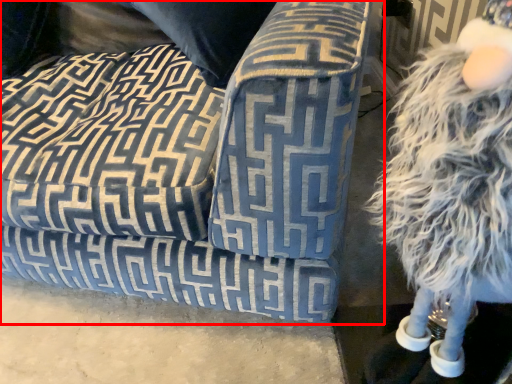
Question: In this image, where is studio couch (annotated by the red box) located relative to figurine?

Choices:
 (A) left
 (B) right

Answer: (A)